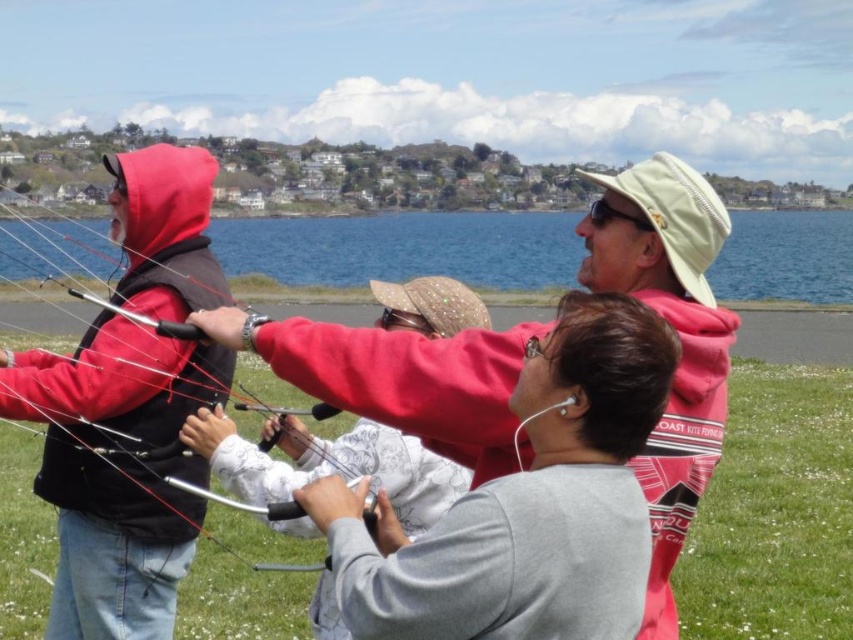
Based on the photo, you are a photographer standing at the edge of the grassy area. You want to take a picture of the matte red hoodie at center and the metallic silver string at center. Which object is closer to the camera?

The matte red hoodie at center is closer to the camera because it is shorter than the metallic silver string at center, which would mean it appears lower in the frame.

You are standing at the viewpoint of the image and want to hand a kite control bar to the person wearing the matte red hoodie at center. If you can throw an object 30 meters, will you be able to reach them?

The matte red hoodie at center is 37.58 meters away from the viewer. Since you can only throw 30 meters, you cannot reach them.